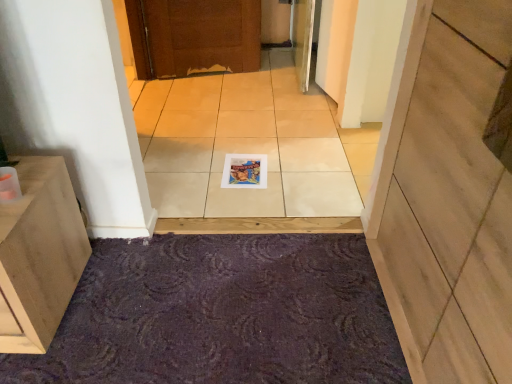
This screenshot has width=512, height=384. Find the location of `free space in front of matte paper magazine at center`. free space in front of matte paper magazine at center is located at coordinates (243, 204).